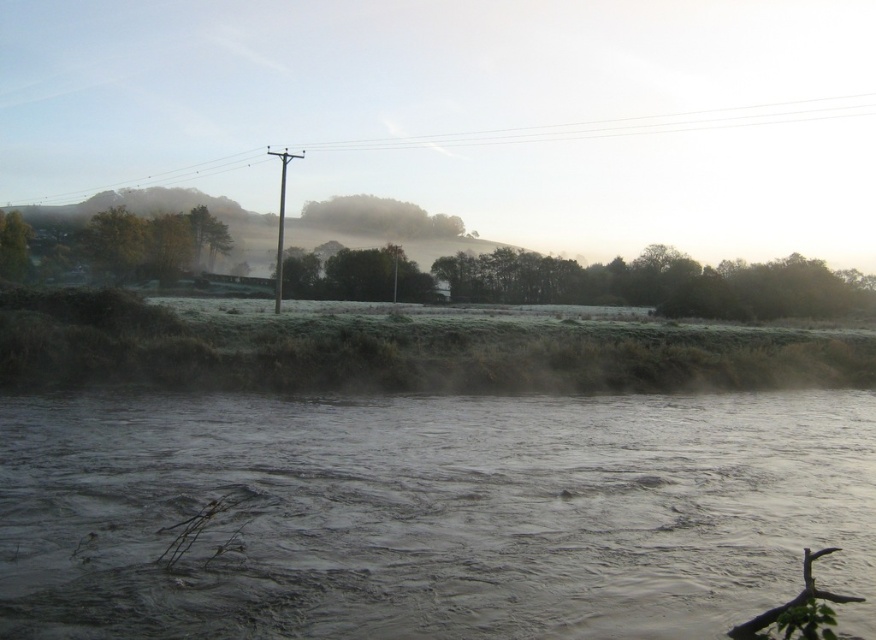
Which is in front, point (362, 221) or point (131, 262)?

Point (131, 262) is in front.

Can you confirm if green matte tree at center is positioned to the right of green matte tree at left?

Indeed, green matte tree at center is positioned on the right side of green matte tree at left.

At what (x,y) coordinates should I click in order to perform the action: click on green matte tree at center. Please return your answer as a coordinate pair (x, y). Image resolution: width=876 pixels, height=640 pixels. Looking at the image, I should click on (379, 218).

The image size is (876, 640). I want to click on green matte tree at center, so pyautogui.click(x=379, y=218).

Which is in front, point (2, 564) or point (280, 252)?

Point (2, 564) is in front.

Who is positioned more to the right, gray murky water at center or metallic gray telegraph pole at center?

gray murky water at center

Where is `gray murky water at center`? The width and height of the screenshot is (876, 640). gray murky water at center is located at coordinates (434, 515).

Looking at this image, who is positioned more to the right, smooth wood pole at upper center or green matte tree at left?

From the viewer's perspective, smooth wood pole at upper center appears more on the right side.

The height and width of the screenshot is (640, 876). Find the location of `smooth wood pole at upper center`. smooth wood pole at upper center is located at coordinates (622, 125).

Locate an element on the screen. smooth wood pole at upper center is located at coordinates (622, 125).

Find the location of `smooth wood pole at upper center`. smooth wood pole at upper center is located at coordinates (622, 125).